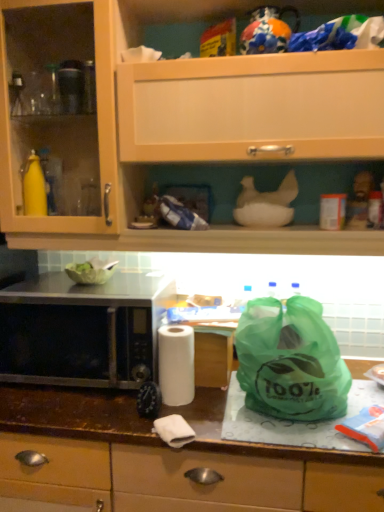
You are a GUI agent. You are given a task and a screenshot of the screen. Output one action in this format:
    pyautogui.click(x=<x>, y=<y>)
    Task: Click on the free space in front of white matte paper towel at center
    Image resolution: width=384 pixels, height=512 pixels.
    Given the screenshot: What is the action you would take?
    click(192, 428)